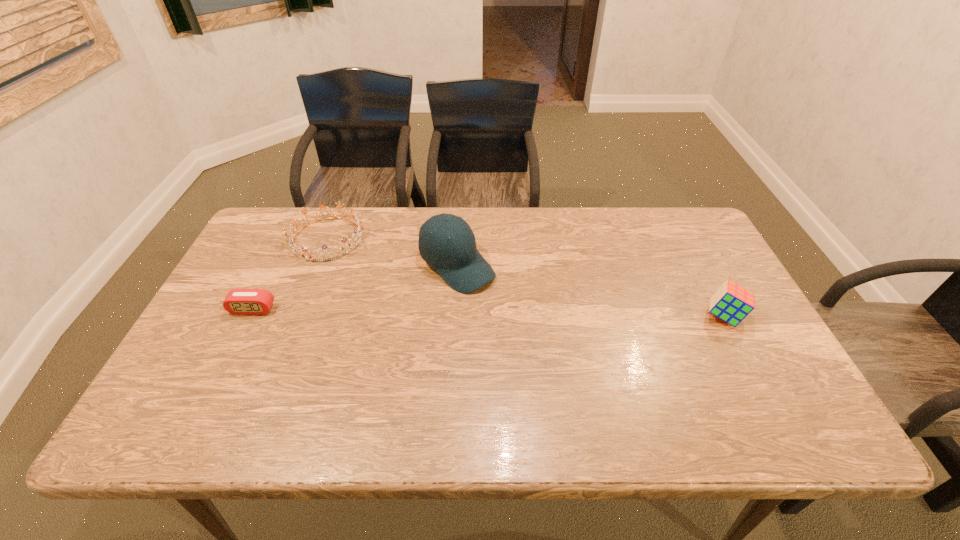
Identify the location of vacant space located 0.220m on the front-facing side of the second shortest object. (394, 291).

Where is `free space located on the front-facing side of the tallest object`? free space located on the front-facing side of the tallest object is located at coordinates (526, 322).

This screenshot has height=540, width=960. Identify the location of free space located 0.110m on the front-facing side of the tallest object. (510, 309).

Find the location of a particular element. vacant space situated 0.260m on the front-facing side of the tallest object is located at coordinates (551, 343).

At what (x,y) coordinates should I click in order to perform the action: click on tiara present at the far edge. Please return your answer as a coordinate pair (x, y). The image size is (960, 540). Looking at the image, I should click on (359, 235).

Locate an element on the screen. The image size is (960, 540). baseball cap situated at the far edge is located at coordinates (457, 260).

In order to click on alarm clock situated at the left edge in this screenshot , I will do `click(238, 301)`.

What are the coordinates of `tiara at the left edge` in the screenshot? It's located at (359, 235).

Find the location of `object that is at the right edge`. object that is at the right edge is located at coordinates (732, 303).

At what (x,y) coordinates should I click in order to perform the action: click on object that is at the far left corner. Please return your answer as a coordinate pair (x, y). Looking at the image, I should click on (359, 235).